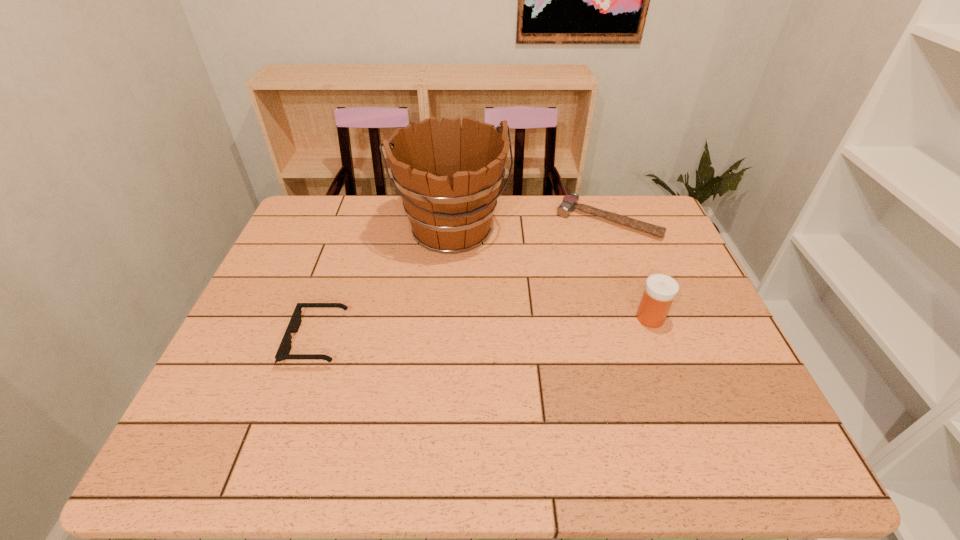
Find the location of a particular element. The image size is (960, 540). vacant space that is in between the leftmost object and the second tallest object is located at coordinates (484, 329).

Identify the location of vacant region between the leftmost object and the hammer. (462, 280).

The width and height of the screenshot is (960, 540). Identify the location of vacant space that's between the wine bucket and the hammer. (530, 225).

Find the location of a particular element. unoccupied position between the hammer and the leftmost object is located at coordinates (462, 280).

Where is `vacant space in between the leftmost object and the hammer`? vacant space in between the leftmost object and the hammer is located at coordinates (462, 280).

You are a GUI agent. You are given a task and a screenshot of the screen. Output one action in this format:
    pyautogui.click(x=<x>, y=<y>)
    Task: Click on the free spot between the second tallest object and the hammer
    The width and height of the screenshot is (960, 540).
    Given the screenshot: What is the action you would take?
    click(629, 269)

Identify the location of free space between the leftmost object and the medicine. (484, 329).

The width and height of the screenshot is (960, 540). Find the location of `free point between the sunglasses and the tallest object`. free point between the sunglasses and the tallest object is located at coordinates (385, 285).

The width and height of the screenshot is (960, 540). Identify the location of vacant space that is in between the hammer and the medicine. (629, 269).

At what (x,y) coordinates should I click in order to perform the action: click on object that can be found as the second closest to the medicine. Please return your answer as a coordinate pair (x, y). Looking at the image, I should click on (448, 177).